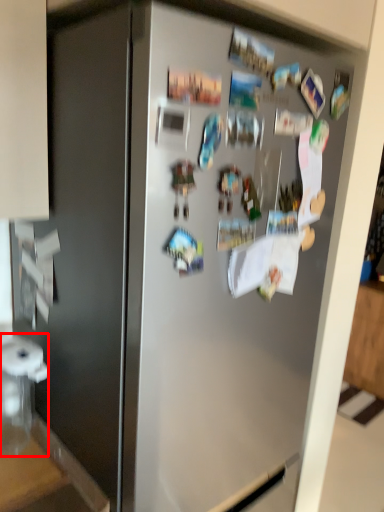
Question: From the image's perspective, where is appliance (annotated by the red box) located in relation to counter top in the image?

Choices:
 (A) below
 (B) above

Answer: (B)